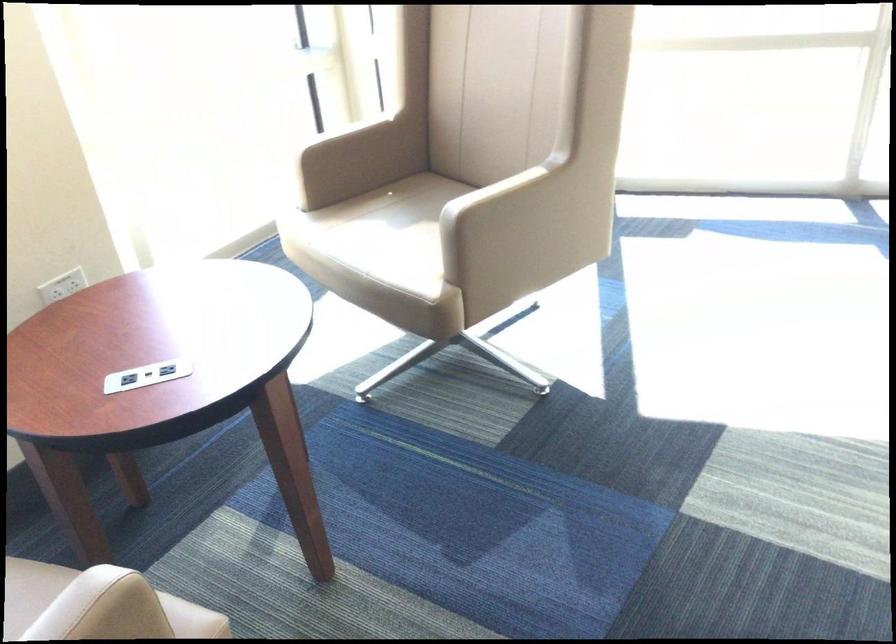
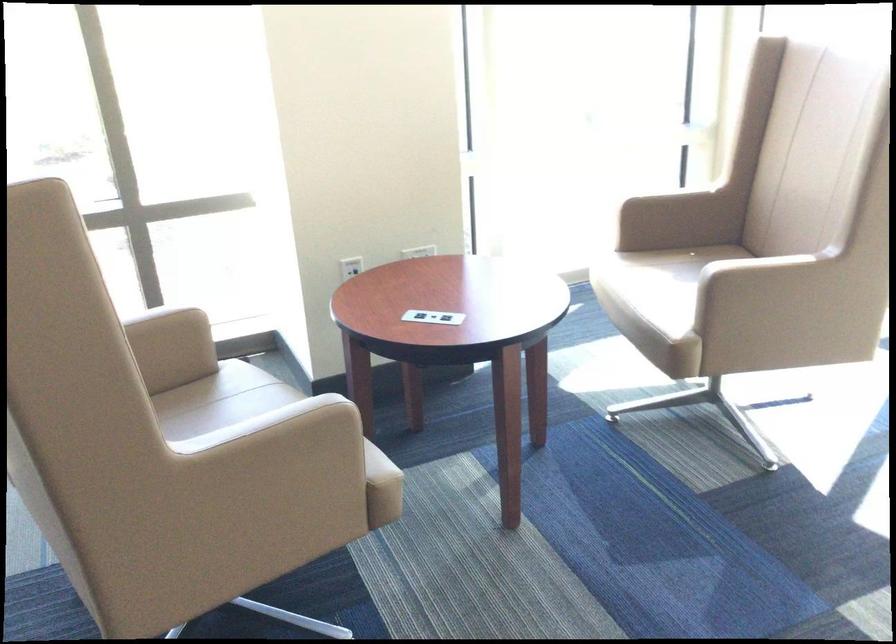
Where in the second image is the point corresponding to (489,207) from the first image?

(744, 270)